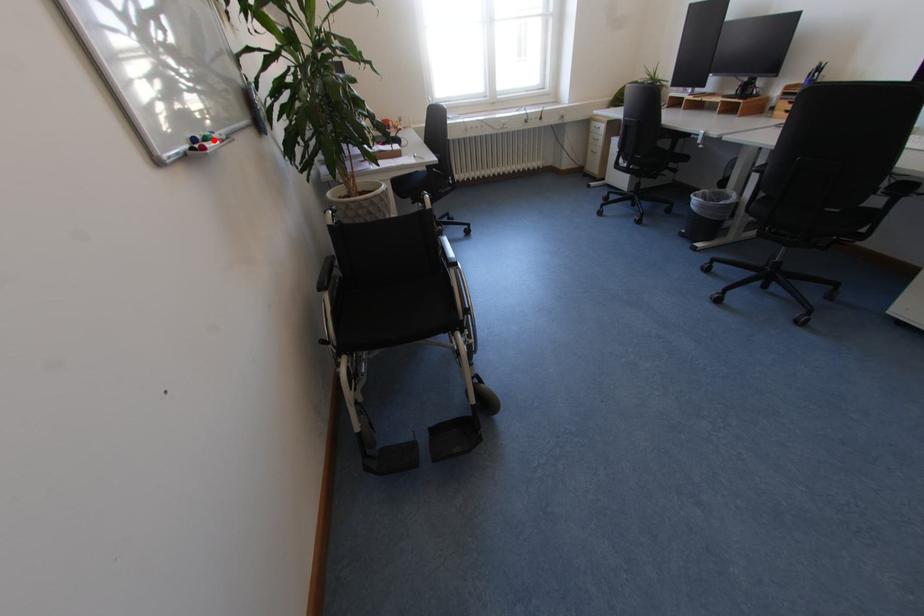
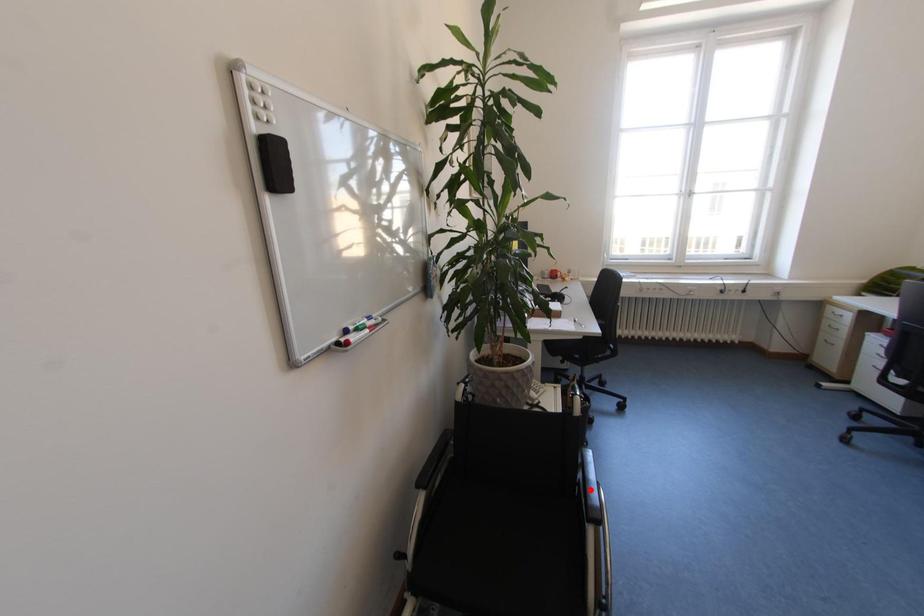
I am providing you with two images of the same scene from different viewpoints. A red point is marked on the first image and another point is marked on the second image. Does the point marked in image1 correspond to the same location as the one in image2?

No